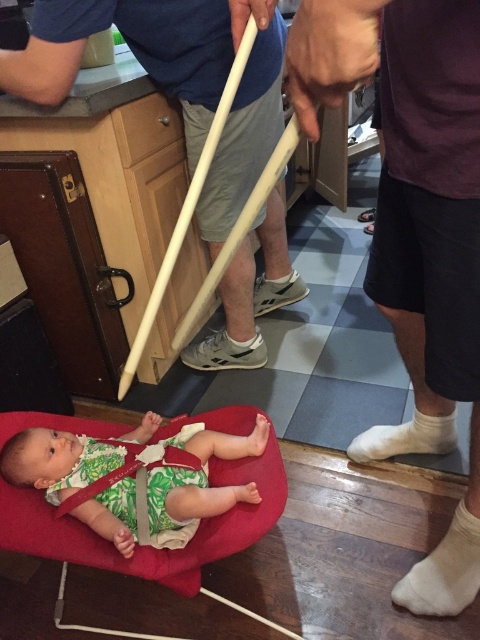
Question: Does green leafy fabric baby at lower left appear on the right side of white cotton sock at lower right?

Choices:
 (A) no
 (B) yes

Answer: (A)

Question: Which point is farther to the camera?

Choices:
 (A) (436, 602)
 (B) (52, 465)

Answer: (A)

Question: Can you confirm if green leafy fabric baby at lower left is thinner than white cotton sock at lower right?

Choices:
 (A) yes
 (B) no

Answer: (B)

Question: Which point is farther to the camera?

Choices:
 (A) green leafy fabric baby at lower left
 (B) white cotton sock at lower right

Answer: (B)

Question: Can you confirm if green leafy fabric baby at lower left is bigger than white cotton sock at lower right?

Choices:
 (A) no
 (B) yes

Answer: (B)